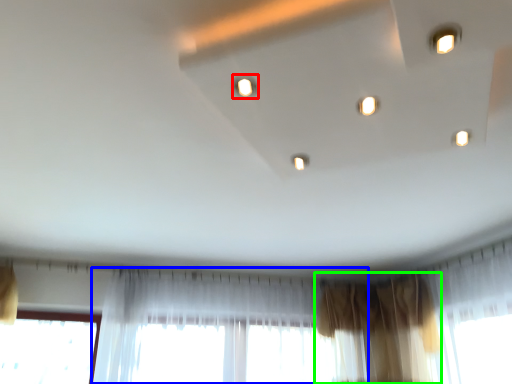
Question: Considering the real-world distances, which object is farthest from light (highlighted by a red box)? curtain (highlighted by a blue box) or curtain (highlighted by a green box)?

Choices:
 (A) curtain
 (B) curtain

Answer: (B)